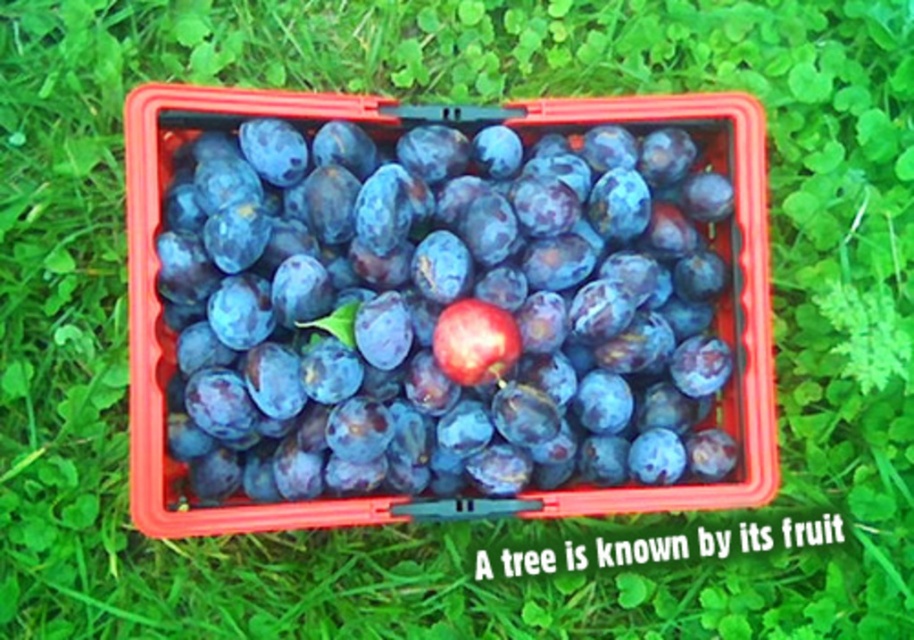
You are a fruit seller who wants to display the plums attractively. You have two plums to choose from the image, the shiny purple plum at center and the shiny red plum at center. Which one should you place in the center of the display to make it more eye catching based on their size?

The shiny purple plum at center is bigger than the shiny red plum at center, so placing the shiny purple plum at center in the center of the display will make it more eye catching due to its larger size.

You are a fruit seller arranging plums in a crate. You have two plums in the center of the crate, a shiny purple plum at center and a shiny red plum at center. Which plum is closer to the front of the crate?

The shiny purple plum at center is closer to the front of the crate because the shiny red plum at center is behind it.

You are a fruit seller who wants to arrange the plums in the crate so that the shiny purple plum at center and the shiny red plum at center are closer together. What is the minimum distance you need to move them to achieve this?

The shiny purple plum at center and shiny red plum at center are currently 18.45 centimeters apart. To make them closer, you need to move them towards each other by at least 18.45 centimeters combined. However, since you can move both plums, the minimum total distance required would be 18.45 centimeters to bring them together.